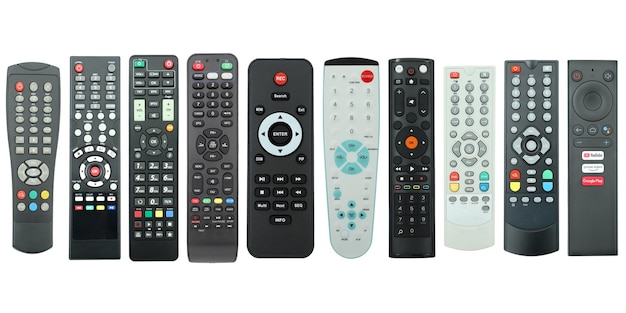
The height and width of the screenshot is (313, 626). Find the location of `first 7 remote controls from the left`. first 7 remote controls from the left is located at coordinates (41, 194), (101, 188), (153, 189), (208, 186), (289, 188), (357, 196), (426, 211).